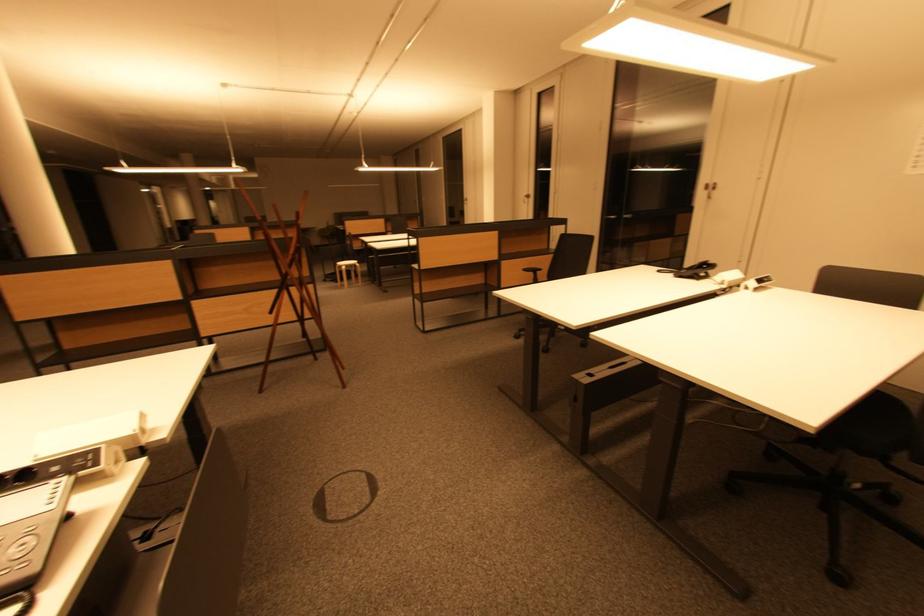
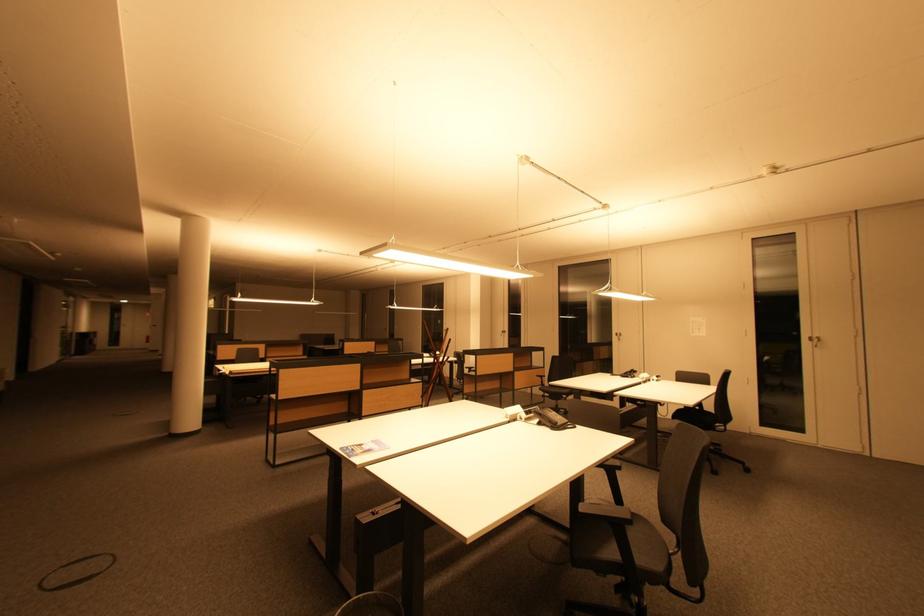
Find the pixel in the second image that matches pixel 702 273 in the first image.

(635, 376)